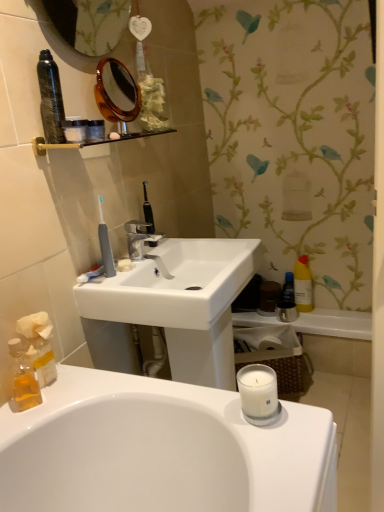
Measure the distance between white paper tissue at lower left and camera.

3.35 feet.

Describe the element at coordinates (116, 92) in the screenshot. The height and width of the screenshot is (512, 384). I see `tortoiseshell plastic mirror at upper center, the 1th mirror when ordered from bottom to top` at that location.

Measure the distance between point (105,75) and camera.

Point (105,75) and camera are 4.29 feet apart.

This screenshot has height=512, width=384. What do you see at coordinates (86, 23) in the screenshot? I see `matte glass mirror at upper left, the 1th mirror positioned from the top` at bounding box center [86, 23].

This screenshot has width=384, height=512. What are the coordinates of `blue glossy mouthwash at right, which ranks as the 2th mouthwash in left-to-right order` in the screenshot? It's located at (288, 288).

How distant is blue glossy mouthwash at right, the 1th mouthwash when ordered from right to left, from matte silver faucet at center?

blue glossy mouthwash at right, the 1th mouthwash when ordered from right to left, is 35.29 inches away from matte silver faucet at center.

Which of these two, blue glossy mouthwash at right, which appears as the second mouthwash when viewed from the front, or matte silver faucet at center, is thinner?

blue glossy mouthwash at right, which appears as the second mouthwash when viewed from the front, is thinner.

Is matte silver faucet at center completely or partially inside blue glossy mouthwash at right, which is the 1th mouthwash in back-to-front order?

That's incorrect, matte silver faucet at center is not inside blue glossy mouthwash at right, which is the 1th mouthwash in back-to-front order.

Who is bigger, tortoiseshell plastic mirror at upper center, which is counted as the 2th mirror, starting from the top, or metallic silver bath at lower right?

metallic silver bath at lower right is bigger.

What's the angular difference between tortoiseshell plastic mirror at upper center, which is counted as the 2th mirror, starting from the top, and metallic silver bath at lower right's facing directions?

tortoiseshell plastic mirror at upper center, which is counted as the 2th mirror, starting from the top, and metallic silver bath at lower right are facing 78.9 degrees away from each other.

From the image's perspective, which is above, tortoiseshell plastic mirror at upper center, the 1th mirror when ordered from bottom to top, or metallic silver bath at lower right?

tortoiseshell plastic mirror at upper center, the 1th mirror when ordered from bottom to top.

Consider the image. Visually, is tortoiseshell plastic mirror at upper center, the 1th mirror when ordered from bottom to top, positioned to the left or to the right of metallic silver bath at lower right?

tortoiseshell plastic mirror at upper center, the 1th mirror when ordered from bottom to top, is to the left of metallic silver bath at lower right.

At what (x,y) coordinates should I click in order to perform the action: click on tissue above the metallic silver bath at lower right (from the image's perspective). Please return your answer as a coordinate pair (x, y). Image resolution: width=384 pixels, height=512 pixels. Looking at the image, I should click on (39, 345).

Considering the relative sizes of white paper tissue at lower left and metallic silver bath at lower right in the image provided, is white paper tissue at lower left shorter than metallic silver bath at lower right?

In fact, white paper tissue at lower left may be taller than metallic silver bath at lower right.

How different are the orientations of white paper tissue at lower left and metallic silver bath at lower right in degrees?

79.6 degrees.

Consider the image. From a real-world perspective, which object stands above the other?

In real-world perspective, white paper tissue at lower left is above.

Is translucent amber liquid at lower left, which is counted as the 1th mouthwash, starting from the left, placed right next to yellow matte bottle at right?

They are not placed beside each other.

From the image's perspective, which one is positioned higher, translucent amber liquid at lower left, which is counted as the 1th mouthwash, starting from the left, or yellow matte bottle at right?

yellow matte bottle at right.

Could you tell me if translucent amber liquid at lower left, which is counted as the 1th mouthwash, starting from the front, is facing yellow matte bottle at right?

No, translucent amber liquid at lower left, which is counted as the 1th mouthwash, starting from the front, is not aimed at yellow matte bottle at right.

Is translucent amber liquid at lower left, which is counted as the 1th mouthwash, starting from the front, behind yellow matte bottle at right?

No, translucent amber liquid at lower left, which is counted as the 1th mouthwash, starting from the front, is in front of yellow matte bottle at right.

Is point (137, 95) farther from viewer compared to point (291, 272)?

No, (137, 95) is in front of (291, 272).

Is tortoiseshell plastic mirror at upper center, which is counted as the 2th mirror, starting from the top, to the left of blue glossy mouthwash at right, which ranks as the 2th mouthwash in left-to-right order, from the viewer's perspective?

Yes, tortoiseshell plastic mirror at upper center, which is counted as the 2th mirror, starting from the top, is to the left of blue glossy mouthwash at right, which ranks as the 2th mouthwash in left-to-right order.

Is tortoiseshell plastic mirror at upper center, the 1th mirror when ordered from bottom to top, positioned in front of blue glossy mouthwash at right, which ranks as the 2th mouthwash in left-to-right order?

Yes, tortoiseshell plastic mirror at upper center, the 1th mirror when ordered from bottom to top, is in front of blue glossy mouthwash at right, which ranks as the 2th mouthwash in left-to-right order.

Considering the relative sizes of metallic silver bath at lower right and white matte soap at center in the image provided, is metallic silver bath at lower right taller than white matte soap at center?

Indeed, metallic silver bath at lower right has a greater height compared to white matte soap at center.

Is metallic silver bath at lower right wider than white matte soap at center?

Yes.

Is point (338, 317) positioned after point (128, 264)?

That is True.

Between metallic silver bath at lower right and white matte soap at center, which one is positioned behind?

metallic silver bath at lower right is further away from the camera.

From the image's perspective, between metallic silver bath at lower right and tortoiseshell plastic mirror at upper center, which is counted as the 2th mirror, starting from the top, who is located below?

metallic silver bath at lower right appears lower in the image.

This screenshot has width=384, height=512. What are the coordinates of `bath that is behind the tortoiseshell plastic mirror at upper center, which is counted as the 2th mirror, starting from the top` in the screenshot? It's located at (335, 324).

From a real-world perspective, which object rests below the other?

metallic silver bath at lower right.

Where is `the 1st mouthwash below the matte silver faucet at center (from the image's perspective)`? This screenshot has height=512, width=384. the 1st mouthwash below the matte silver faucet at center (from the image's perspective) is located at coordinates (288, 288).

The image size is (384, 512). In order to click on the 1st mirror in front of the metallic silver bath at lower right in this screenshot , I will do pos(116,92).

Based on their spatial positions, is white paper tissue at lower left or yellow matte bottle at right closer to tortoiseshell plastic mirror at upper center, which is counted as the 2th mirror, starting from the top?

white paper tissue at lower left lies closer to tortoiseshell plastic mirror at upper center, which is counted as the 2th mirror, starting from the top, than the other object.

In the scene shown: From the image, which object appears to be nearer to matte silver faucet at center, white paper tissue at lower left or white matte soap at center?

Based on the image, white matte soap at center appears to be nearer to matte silver faucet at center.

When comparing their distances from metallic silver bath at lower right, does blue glossy mouthwash at right, which ranks as the 2th mouthwash in left-to-right order, or white paper tissue at lower left seem closer?

Based on the image, blue glossy mouthwash at right, which ranks as the 2th mouthwash in left-to-right order, appears to be nearer to metallic silver bath at lower right.

Estimate the real-world distances between objects in this image. Which object is further from yellow matte bottle at right, matte glass mirror at upper left, the 1th mirror positioned from the top, or white paper tissue at lower left?

Based on the image, white paper tissue at lower left appears to be further to yellow matte bottle at right.

When comparing their distances from metallic silver bath at lower right, does tortoiseshell plastic mirror at upper center, which is counted as the 2th mirror, starting from the top, or translucent amber liquid at lower left, placed as the second mouthwash when sorted from back to front, seem closer?

Among the two, tortoiseshell plastic mirror at upper center, which is counted as the 2th mirror, starting from the top, is located nearer to metallic silver bath at lower right.

When comparing their distances from translucent amber liquid at lower left, acting as the second mouthwash starting from the right, does white paper tissue at lower left or yellow matte bottle at right seem closer?

white paper tissue at lower left is positioned closer to the anchor translucent amber liquid at lower left, acting as the second mouthwash starting from the right.

When comparing their distances from metallic silver bath at lower right, does white paper tissue at lower left or white matte soap at center seem closer?

white matte soap at center lies closer to metallic silver bath at lower right than the other object.

Based on their spatial positions, is matte silver faucet at center or yellow matte bottle at right closer to metallic silver bath at lower right?

yellow matte bottle at right is positioned closer to the anchor metallic silver bath at lower right.

Where is `bottle between matte glass mirror at upper left, the 1th mirror positioned from the top, and blue glossy mouthwash at right, which ranks as the 2th mouthwash in left-to-right order, in the front-back direction`? bottle between matte glass mirror at upper left, the 1th mirror positioned from the top, and blue glossy mouthwash at right, which ranks as the 2th mouthwash in left-to-right order, in the front-back direction is located at coordinates (303, 285).

Find the location of `tap between white paper tissue at lower left and metallic silver bath at lower right in the horizontal direction`. tap between white paper tissue at lower left and metallic silver bath at lower right in the horizontal direction is located at coordinates (143, 243).

Where is `tissue between matte glass mirror at upper left, the 1th mirror positioned from the top, and yellow matte bottle at right in the front-back direction`? This screenshot has height=512, width=384. tissue between matte glass mirror at upper left, the 1th mirror positioned from the top, and yellow matte bottle at right in the front-back direction is located at coordinates (39, 345).

Locate an element on the screen. The height and width of the screenshot is (512, 384). tap between matte glass mirror at upper left, the 1th mirror positioned from the top, and white paper tissue at lower left in the up-down direction is located at coordinates (143, 243).